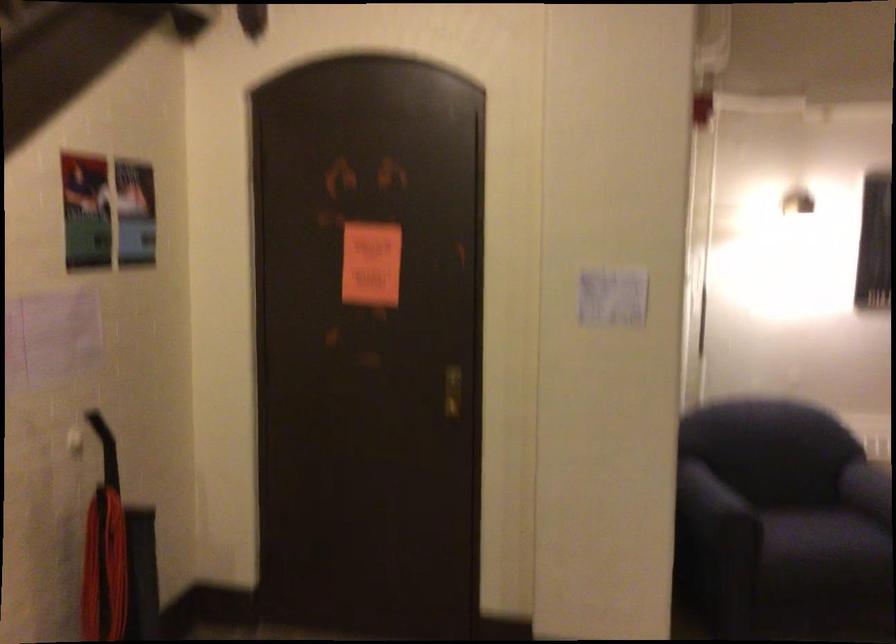
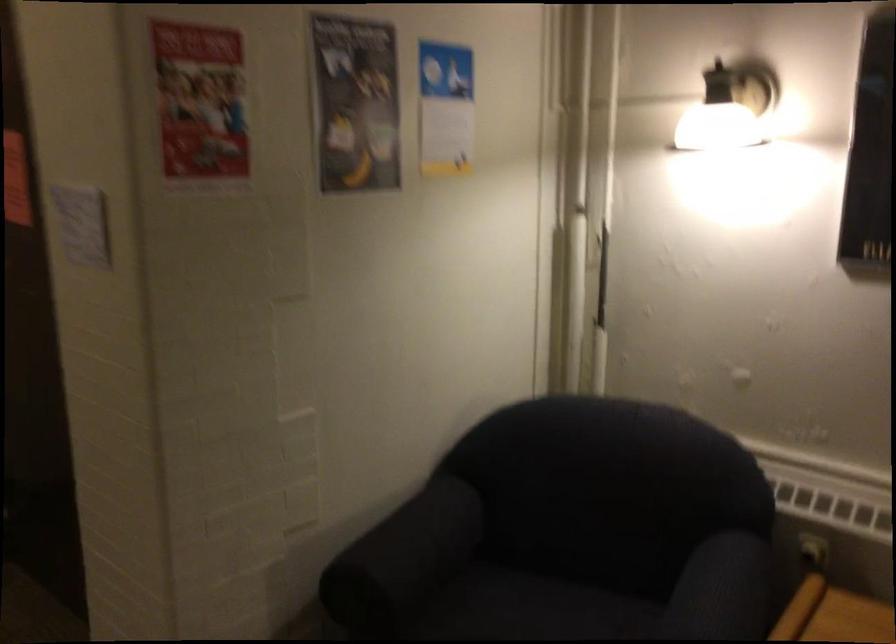
What movement of the cameraman would produce the second image?

The cameraman walked toward right, forward.